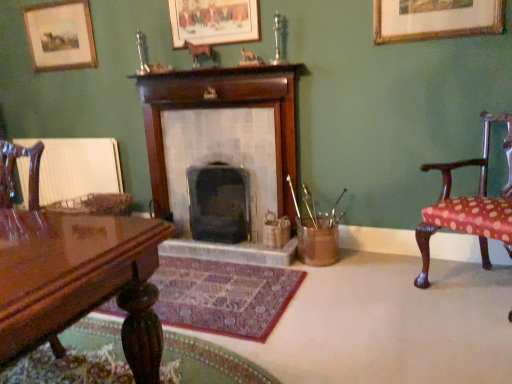
Identify the location of vacant space in polka dot fabric chair at right, the first chair viewed from the right (from a real-world perspective). (468, 284).